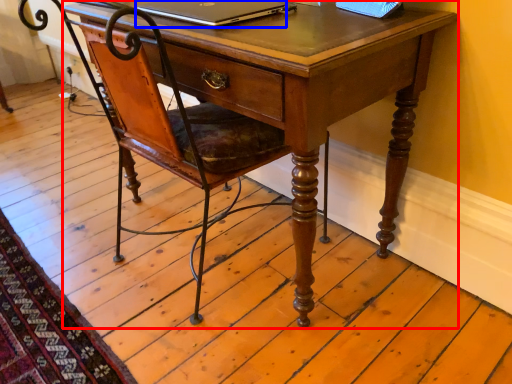
Question: Which of the following is the closest to the observer, desk (highlighted by a red box) or laptop (highlighted by a blue box)?

Choices:
 (A) desk
 (B) laptop

Answer: (A)